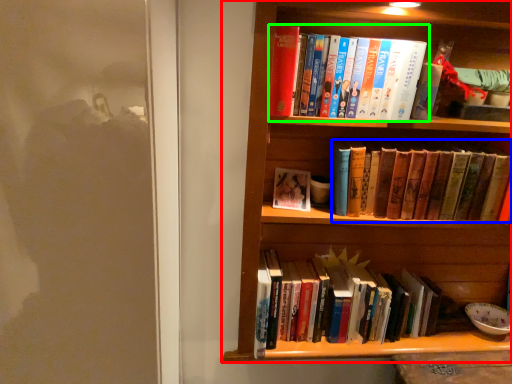
Question: Which is nearer to the bookcase (highlighted by a red box)? book (highlighted by a blue box) or book (highlighted by a green box).

Choices:
 (A) book
 (B) book

Answer: (A)